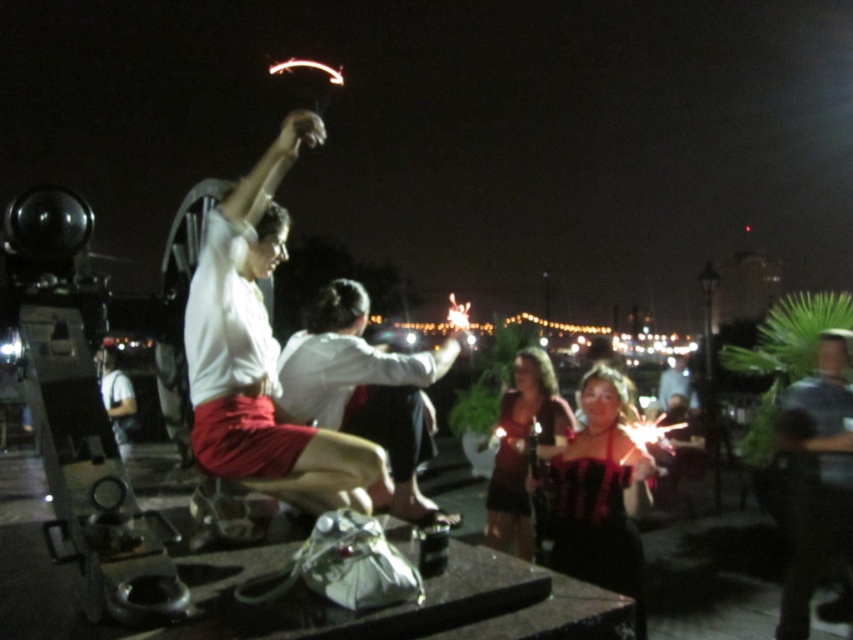
Question: Does black velvet dress at center appear on the left side of matte brown dress at center?

Choices:
 (A) yes
 (B) no

Answer: (B)

Question: Which object is positioned farthest from the black velvet dress at center?

Choices:
 (A) white matte shirt at center
 (B) white shirt at center
 (C) matte brown dress at center
 (D) dark blue shirt at right

Answer: (D)

Question: Which point appears farthest from the camera in this image?

Choices:
 (A) (283, 152)
 (B) (393, 493)

Answer: (B)

Question: Considering the relative positions of white shirt at center and matte brown dress at center in the image provided, where is white shirt at center located with respect to matte brown dress at center?

Choices:
 (A) above
 (B) below

Answer: (A)

Question: Where is white shirt at center located in relation to matte brown dress at center in the image?

Choices:
 (A) right
 (B) left

Answer: (B)

Question: Which object is positioned closest to the white shirt at center?

Choices:
 (A) white matte shirt at center
 (B) matte brown dress at center
 (C) black velvet dress at center
 (D) dark blue shirt at right

Answer: (A)